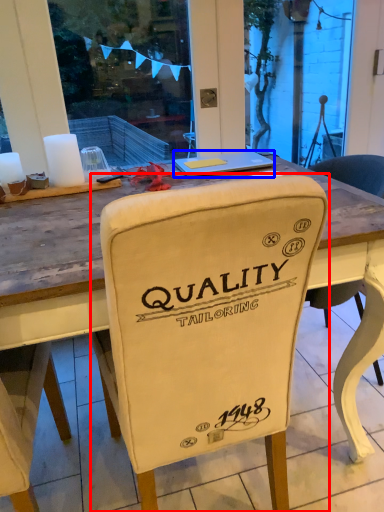
Question: Which point is closer to the camera, chair (highlighted by a red box) or laptop (highlighted by a blue box)?

Choices:
 (A) chair
 (B) laptop

Answer: (A)